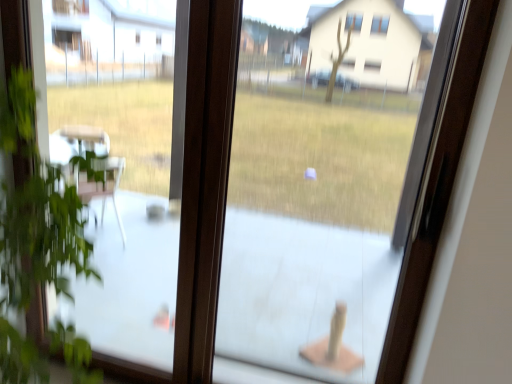
Identify the location of brown plastic window frame at center. (127, 152).

Describe the element at coordinates (127, 152) in the screenshot. The height and width of the screenshot is (384, 512). I see `brown plastic window frame at center` at that location.

Where is `brown plastic window frame at center`? The image size is (512, 384). brown plastic window frame at center is located at coordinates (127, 152).